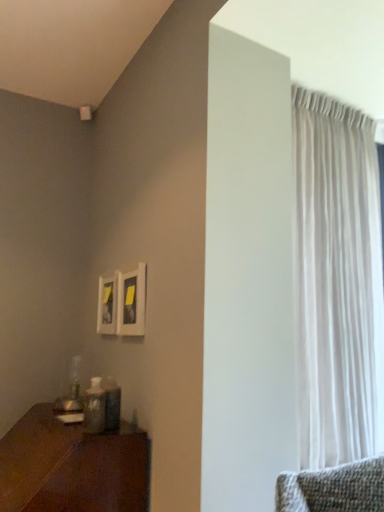
Locate an element on the screen. wooden table at lower left is located at coordinates pos(72,467).

This screenshot has width=384, height=512. What do you see at coordinates (72, 467) in the screenshot?
I see `wooden table at lower left` at bounding box center [72, 467].

At what (x,y) coordinates should I click in order to perform the action: click on white sheer curtain at right. Please return your answer as a coordinate pair (x, y). Looking at the image, I should click on (337, 282).

The width and height of the screenshot is (384, 512). What do you see at coordinates (337, 282) in the screenshot?
I see `white sheer curtain at right` at bounding box center [337, 282].

Where is `wooden table at lower left`? The image size is (384, 512). wooden table at lower left is located at coordinates (72, 467).

Is wooden table at lower left at the left side of white sheer curtain at right?

Yes, wooden table at lower left is to the left of white sheer curtain at right.

Which is behind, wooden table at lower left or white sheer curtain at right?

white sheer curtain at right is behind.

Is point (140, 485) farther from camera compared to point (334, 356)?

That is False.

From the image's perspective, which is below, wooden table at lower left or white sheer curtain at right?

wooden table at lower left appears lower in the image.

From a real-world perspective, is wooden table at lower left below white sheer curtain at right?

Yes, from a real-world perspective, wooden table at lower left is beneath white sheer curtain at right.

Which of these two, wooden table at lower left or white sheer curtain at right, is thinner?

white sheer curtain at right.

Can you confirm if wooden table at lower left is taller than white sheer curtain at right?

In fact, wooden table at lower left may be shorter than white sheer curtain at right.

Does wooden table at lower left have a larger size compared to white sheer curtain at right?

Correct, wooden table at lower left is larger in size than white sheer curtain at right.

Is white sheer curtain at right a part of wooden table at lower left?

No, white sheer curtain at right is not surrounded by wooden table at lower left.

Is wooden table at lower left far away from white sheer curtain at right?

They are positioned close to each other.

Is wooden table at lower left aimed at white sheer curtain at right?

No, wooden table at lower left is not aimed at white sheer curtain at right.

I want to click on table below the white sheer curtain at right (from a real-world perspective), so click(72, 467).

Which is more to the right, white sheer curtain at right or wooden table at lower left?

Positioned to the right is white sheer curtain at right.

Is white sheer curtain at right positioned in front of wooden table at lower left?

No, white sheer curtain at right is behind wooden table at lower left.

Is point (362, 190) farther from camera compared to point (88, 490)?

Yes, point (362, 190) is farther from viewer.

From the image's perspective, which one is positioned higher, white sheer curtain at right or wooden table at lower left?

white sheer curtain at right, from the image's perspective.

From a real-world perspective, is white sheer curtain at right on top of wooden table at lower left?

Yes, from a real-world perspective, white sheer curtain at right is over wooden table at lower left

Is white sheer curtain at right thinner than wooden table at lower left?

Yes.

Who is shorter, white sheer curtain at right or wooden table at lower left?

wooden table at lower left.

Does white sheer curtain at right have a smaller size compared to wooden table at lower left?

Indeed, white sheer curtain at right has a smaller size compared to wooden table at lower left.

Is white sheer curtain at right completely or partially outside of wooden table at lower left?

That's correct, white sheer curtain at right is outside of wooden table at lower left.

Is white sheer curtain at right far from wooden table at lower left?

That's not correct — white sheer curtain at right is a little close to wooden table at lower left.

Is white sheer curtain at right aimed at wooden table at lower left?

No.

How different are the orientations of white sheer curtain at right and wooden table at lower left in degrees?

The angle between the facing direction of white sheer curtain at right and the facing direction of wooden table at lower left is 90 degrees.

Find the location of a particular element. This screenshot has height=512, width=384. curtain located on the right of wooden table at lower left is located at coordinates (337, 282).

I want to click on table lying below the white sheer curtain at right (from the image's perspective), so click(x=72, y=467).

The height and width of the screenshot is (512, 384). Find the location of `curtain on the right of wooden table at lower left`. curtain on the right of wooden table at lower left is located at coordinates (337, 282).